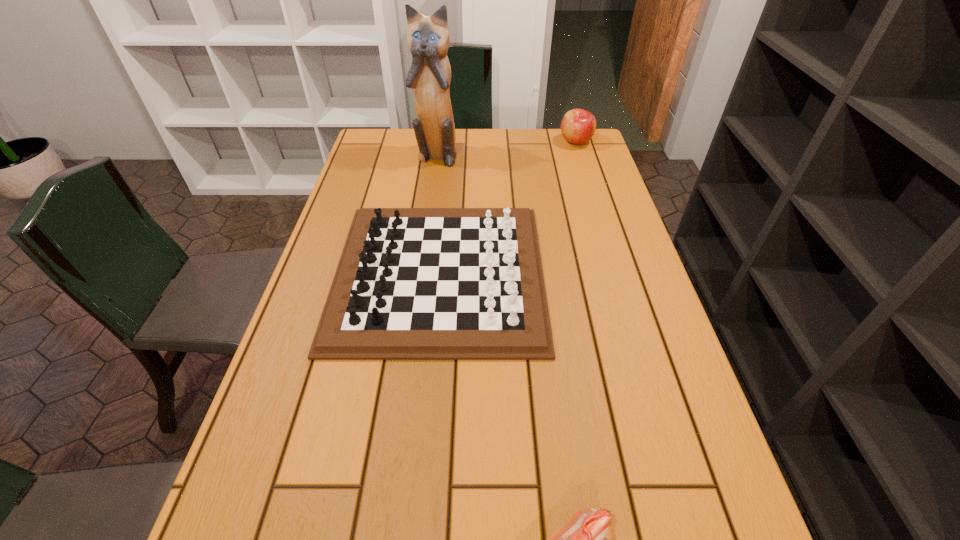
This screenshot has width=960, height=540. Identify the location of cat. (428, 39).

I want to click on the rightmost object, so click(578, 126).

Find the location of a particular element. Image resolution: width=960 pixels, height=540 pixels. apple is located at coordinates (578, 126).

I want to click on gameboard, so click(x=412, y=283).

What are the coordinates of `the second shortest object` in the screenshot? It's located at (412, 283).

Locate an element on the screen. The width and height of the screenshot is (960, 540). blank space located on the face of the cat is located at coordinates (426, 222).

Image resolution: width=960 pixels, height=540 pixels. I want to click on free spot located 0.360m on the left of the third shortest object, so pyautogui.click(x=454, y=141).

You are a GUI agent. You are given a task and a screenshot of the screen. Output one action in this format:
    pyautogui.click(x=<x>, y=<y>)
    Task: Click on the free space located 0.220m on the right of the second shortest object
    This screenshot has height=540, width=960.
    Given the screenshot: What is the action you would take?
    pyautogui.click(x=635, y=274)

Locate an element on the screen. Image resolution: width=960 pixels, height=540 pixels. cat located at the far edge is located at coordinates (428, 39).

Where is `apple present at the far edge`? Image resolution: width=960 pixels, height=540 pixels. apple present at the far edge is located at coordinates (578, 126).